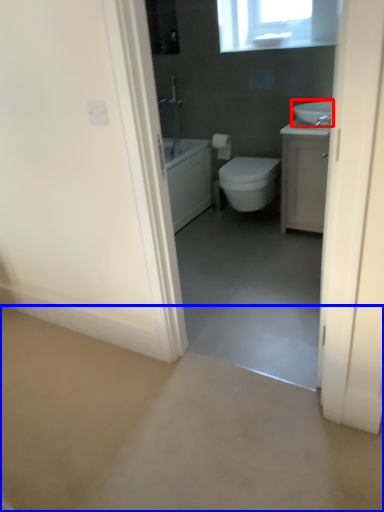
Question: Which point is further to the camera, sink (highlighted by a red box) or concrete (highlighted by a blue box)?

Choices:
 (A) sink
 (B) concrete

Answer: (A)